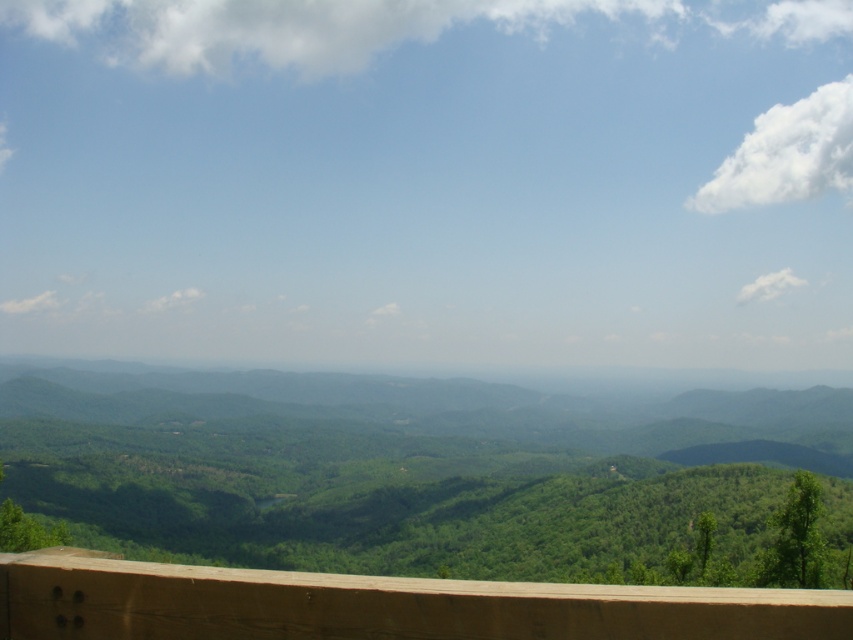
Consider the image. Is green matte forest at center shorter than brown wooden ledge at lower center?

Incorrect, green matte forest at center's height does not fall short of brown wooden ledge at lower center's.

Which is below, green matte forest at center or brown wooden ledge at lower center?

green matte forest at center is below.

Locate an element on the screen. This screenshot has height=640, width=853. green matte forest at center is located at coordinates (428, 476).

At what (x,y) coordinates should I click in order to perform the action: click on green matte forest at center. Please return your answer as a coordinate pair (x, y). The width and height of the screenshot is (853, 640). Looking at the image, I should click on (428, 476).